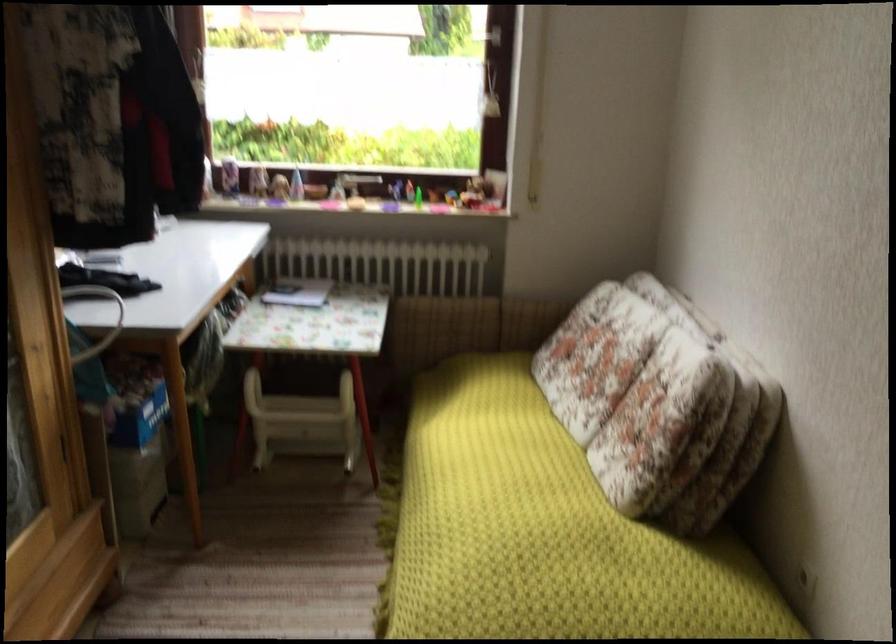
Identify the location of sofa sitting surface. This screenshot has height=644, width=896. (544, 532).